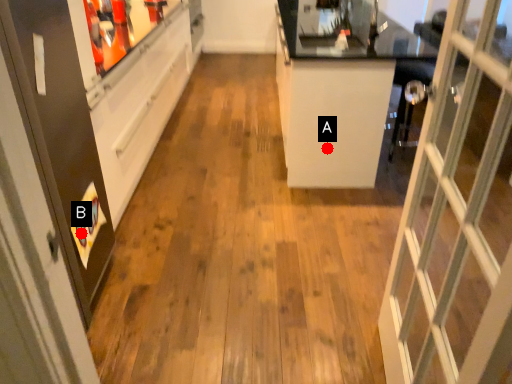
Question: Two points are circled on the image, labeled by A and B beside each circle. Among these points, which one is farthest from the camera?

Choices:
 (A) A is further
 (B) B is further

Answer: (A)